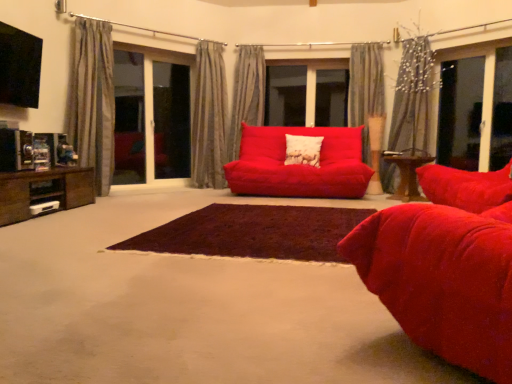
Describe the element at coordinates (475, 107) in the screenshot. I see `transparent glass window at right` at that location.

At what (x,y) coordinates should I click in order to perform the action: click on transparent glass window at right. Please return your answer as a coordinate pair (x, y). This screenshot has height=384, width=512. Looking at the image, I should click on (475, 107).

Image resolution: width=512 pixels, height=384 pixels. What do you see at coordinates (303, 150) in the screenshot? I see `white textured pillow at center` at bounding box center [303, 150].

Measure the distance between point (315, 140) and camera.

15.36 feet.

Describe the element at coordinates (368, 104) in the screenshot. I see `gray fabric curtain at upper center, positioned as the 4th curtain in left-to-right order` at that location.

This screenshot has width=512, height=384. What do you see at coordinates (298, 164) in the screenshot?
I see `matte red couch at center` at bounding box center [298, 164].

Find the location of a particular element. The image size is (512, 384). transparent glass window at right is located at coordinates 475,107.

From the image's perspective, between gray textured curtain at center, the second curtain viewed from the left, and matte red couch at center, who is located below?

matte red couch at center appears lower in the image.

Is point (218, 80) behind point (274, 150)?

Yes.

Which of these two, gray textured curtain at center, which is the fourth curtain in right-to-left order, or matte red couch at center, is thinner?

gray textured curtain at center, which is the fourth curtain in right-to-left order.

Is velvet red studio couch at center looking in the opposite direction of dark brown shaggy rug at center?

No, velvet red studio couch at center is not facing away from dark brown shaggy rug at center.

Considering the relative sizes of velvet red studio couch at center and dark brown shaggy rug at center in the image provided, is velvet red studio couch at center thinner than dark brown shaggy rug at center?

Correct, the width of velvet red studio couch at center is less than that of dark brown shaggy rug at center.

Considering the sizes of objects velvet red studio couch at center and dark brown shaggy rug at center in the image provided, who is taller, velvet red studio couch at center or dark brown shaggy rug at center?

velvet red studio couch at center is taller.

From a real-world perspective, is velvet red studio couch at center located higher than dark brown shaggy rug at center?

Yes, from a real-world perspective, velvet red studio couch at center is above dark brown shaggy rug at center.

Does dark brown shaggy rug at center appear on the left side of velvet red studio couch at center?

Indeed, dark brown shaggy rug at center is positioned on the left side of velvet red studio couch at center.

In the scene shown: Which of these two, dark brown shaggy rug at center or velvet red studio couch at center, is bigger?

Bigger between the two is velvet red studio couch at center.

Who is more distant, dark brown shaggy rug at center or velvet red studio couch at center?

dark brown shaggy rug at center.

Can you confirm if wooden table at center, which is counted as the 2th table, starting from the front, is wider than matte red couch at center?

Incorrect, the width of wooden table at center, which is counted as the 2th table, starting from the front, does not surpass that of matte red couch at center.

Does wooden table at center, positioned as the second table in left-to-right order, have a greater width compared to silky gray curtain at upper right, the 5th curtain from the left?

Yes.

Can you tell me how much wooden table at center, positioned as the 1th table in right-to-left order, and silky gray curtain at upper right, the 5th curtain from the left, differ in facing direction?

There is a 35.6-degree angle between the facing directions of wooden table at center, positioned as the 1th table in right-to-left order, and silky gray curtain at upper right, the 5th curtain from the left.

Is wooden table at center, positioned as the 1th table in back-to-front order, at the right side of silky gray curtain at upper right, arranged as the 1th curtain when viewed from the right?

Incorrect, wooden table at center, positioned as the 1th table in back-to-front order, is not on the right side of silky gray curtain at upper right, arranged as the 1th curtain when viewed from the right.

Considering the points (399, 166) and (391, 180), which point is behind, point (399, 166) or point (391, 180)?

Positioned behind is point (391, 180).

Is the position of satin gray curtain at center, placed as the 3th curtain when sorted from right to left, more distant than that of silky gray curtain at upper right, arranged as the 1th curtain when viewed from the right?

Yes, it is.

Which object is positioned more to the left, satin gray curtain at center, placed as the 3th curtain when sorted from right to left, or silky gray curtain at upper right, the 5th curtain from the left?

satin gray curtain at center, placed as the 3th curtain when sorted from right to left, is more to the left.

From a real-world perspective, does satin gray curtain at center, acting as the 3th curtain starting from the left, stand above silky gray curtain at upper right, the 5th curtain from the left?

Yes, from a real-world perspective, satin gray curtain at center, acting as the 3th curtain starting from the left, is above silky gray curtain at upper right, the 5th curtain from the left.

Is satin gray curtain at center, acting as the 3th curtain starting from the left, positioned beyond the bounds of silky gray curtain at upper right, the 5th curtain from the left?

satin gray curtain at center, acting as the 3th curtain starting from the left, lies outside silky gray curtain at upper right, the 5th curtain from the left,'s area.

From the image's perspective, is white textured pillow at center above matte red couch at center?

Yes, from the image's perspective, white textured pillow at center is on top of matte red couch at center.

From a real-world perspective, which is physically below, white textured pillow at center or matte red couch at center?

matte red couch at center, from a real-world perspective.

Which is closer, (304,163) or (259,191)?

Point (304,163) is positioned closer to the camera compared to point (259,191).

The height and width of the screenshot is (384, 512). In order to click on the 2nd curtain counting from the left of the matte red couch at center in this screenshot , I will do `click(208, 117)`.

Identify the location of plain lying below the velvet red studio couch at center (from the image's perspective). This screenshot has width=512, height=384. (253, 232).

In the scene shown: Looking at the image, which one is located closer to gray textured curtain at center, which is the fourth curtain in right-to-left order, transparent glass window at right or gray textured curtain at left, marked as the first curtain in a left-to-right arrangement?

gray textured curtain at left, marked as the first curtain in a left-to-right arrangement, is closer to gray textured curtain at center, which is the fourth curtain in right-to-left order.

From the image, which object appears to be farther from white textured pillow at center, gray textured curtain at left, the 5th curtain when ordered from right to left, or gray textured curtain at center, the second curtain viewed from the left?

gray textured curtain at left, the 5th curtain when ordered from right to left, lies further to white textured pillow at center than the other object.

When comparing their distances from transparent glass screen door at left, marked as the second screen door in a right-to-left arrangement, does gray textured curtain at left, marked as the first curtain in a left-to-right arrangement, or transparent glass window at right seem closer?

Based on the image, gray textured curtain at left, marked as the first curtain in a left-to-right arrangement, appears to be nearer to transparent glass screen door at left, marked as the second screen door in a right-to-left arrangement.

Considering their positions, is transparent glass screen door at left, marked as the second screen door in a right-to-left arrangement, positioned closer to matte red couch at center than velvet red studio couch at center?

velvet red studio couch at center is closer to matte red couch at center.

Considering their positions, is transparent glass screen door at left, arranged as the 2th screen door when viewed from the left, positioned further to transparent glass screen door at left, which is the first screen door from left to right, than brown wood entertainment unit at left, which is the first table in left-to-right order?

brown wood entertainment unit at left, which is the first table in left-to-right order.

Estimate the real-world distances between objects in this image. Which object is closer to velvet red studio couch at center, satin gray curtain at center, placed as the 3th curtain when sorted from right to left, or gray textured curtain at center, which is the fourth curtain in right-to-left order?

gray textured curtain at center, which is the fourth curtain in right-to-left order.

Based on their spatial positions, is white textured pillow at center or dark brown shaggy rug at center closer to gray textured curtain at center, which is the fourth curtain in right-to-left order?

white textured pillow at center is closer to gray textured curtain at center, which is the fourth curtain in right-to-left order.

When comparing their distances from gray textured curtain at center, the second curtain viewed from the left, does silky gray curtain at upper right, arranged as the 1th curtain when viewed from the right, or satin gray curtain at center, acting as the 3th curtain starting from the left, seem closer?

Among the two, satin gray curtain at center, acting as the 3th curtain starting from the left, is located nearer to gray textured curtain at center, the second curtain viewed from the left.

The image size is (512, 384). What are the coordinates of `pillow between gray fabric curtain at upper center, positioned as the 4th curtain in left-to-right order, and wooden table at center, positioned as the 1th table in back-to-front order, from top to bottom` in the screenshot? It's located at (303, 150).

Find the location of a particular element. The height and width of the screenshot is (384, 512). curtain located between velvet red studio couch at center and silky gray curtain at upper right, arranged as the 1th curtain when viewed from the right, in the depth direction is located at coordinates (92, 100).

I want to click on curtain located between dark brown shaggy rug at center and matte red couch at center in the depth direction, so click(x=92, y=100).

I want to click on pillow between dark brown shaggy rug at center and gray textured curtain at center, the second curtain viewed from the left, along the z-axis, so click(303, 150).